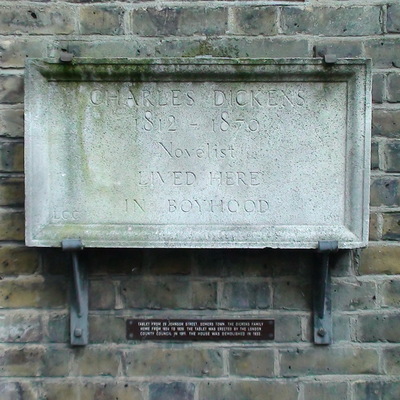
At what (x,y) coordinates should I click in order to perform the action: click on bracket. Please return your answer as a coordinate pair (x, y). This screenshot has height=400, width=400. Looking at the image, I should click on (78, 303), (320, 302), (67, 55), (322, 50).